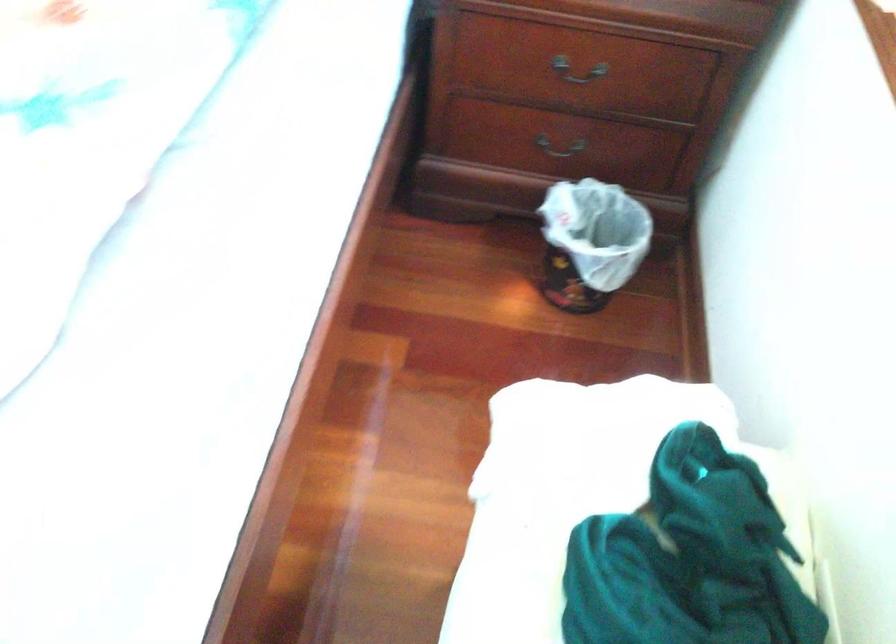
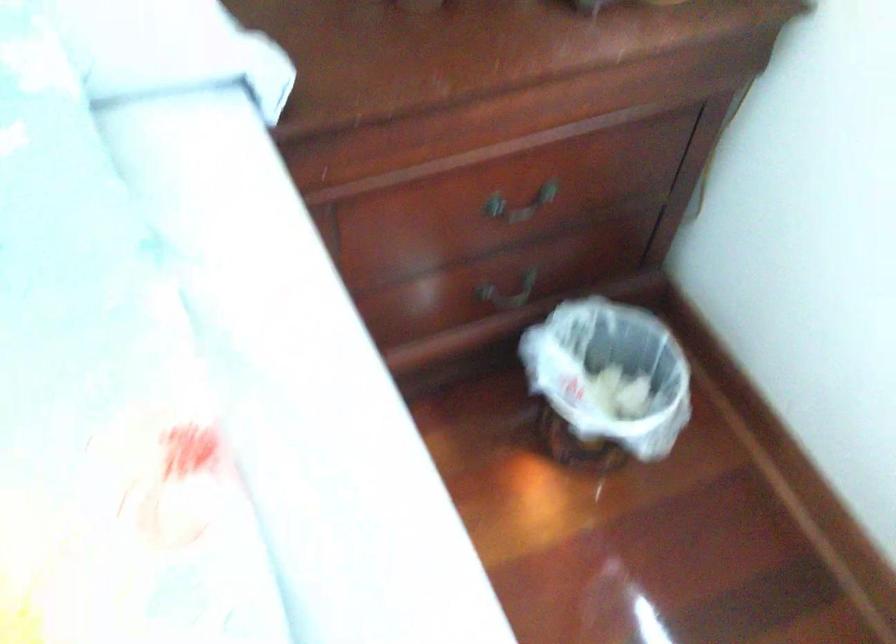
Locate, in the second image, the point that corresponds to point 561,152 in the first image.

(509, 292)